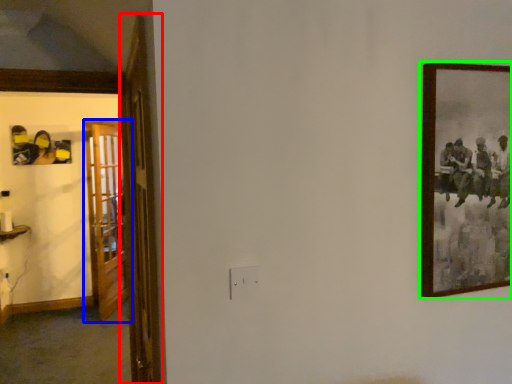
Question: Which is nearer to the door (highlighted by a red box)? door (highlighted by a blue box) or picture frame (highlighted by a green box).

Choices:
 (A) door
 (B) picture frame

Answer: (B)